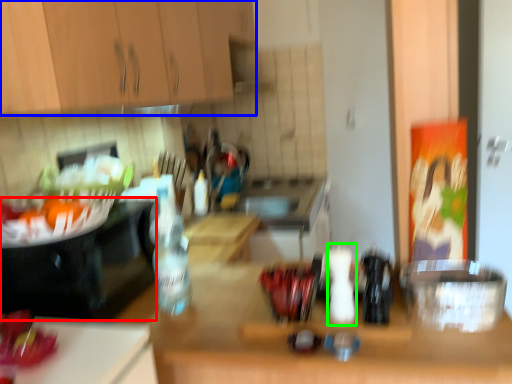
Question: Which object is the farthest from appliance (highlighted by a red box)? Choose among these: cabinetry (highlighted by a blue box) or bottle (highlighted by a green box).

Choices:
 (A) cabinetry
 (B) bottle

Answer: (B)